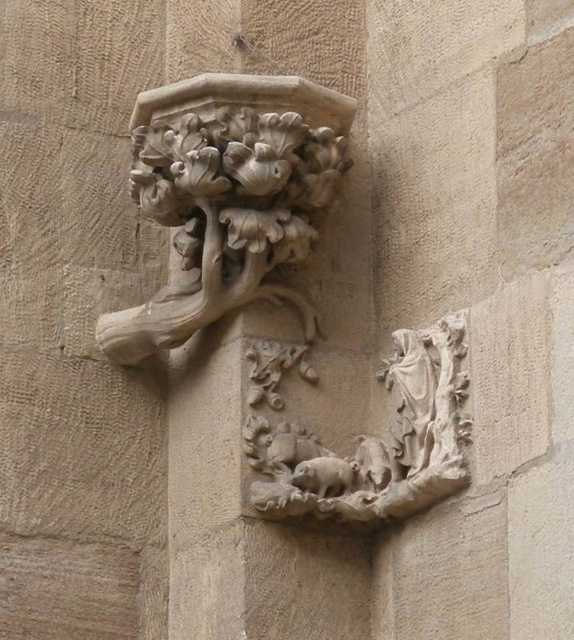
In the scene shown: You are an architect inspecting the stone carving on the building. You notice two elements, the carved stone floral motif at upper center and the carved stone relief at center. Which of these two elements is larger in size?

The carved stone floral motif at upper center is bigger than the carved stone relief at center.

You are an architect examining the stone carving on the building. You notice two points marked on the carving. The first point is at coordinate point (148, 154) and the second is at point (413, 413). If you were to touch both points with your finger, which point would feel closer to you?

Point (148, 154) is further to the camera than point (413, 413). Therefore, when touching both points, the point at (413, 413) would feel closer to you because it is positioned closer to the viewer compared to the other point.

You are an architect examining the stone carving on the building. You notice a specific point marked at coordinates [228,196]. Based on the carving details, what is the significance of this point?

The point marked at coordinates [228,196] marks the carved stone floral motif at upper center, indicating its central position in the floral section of the carving.